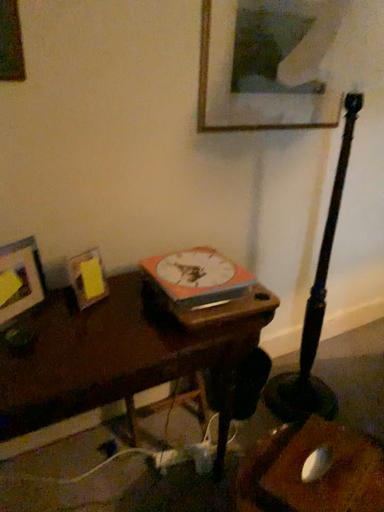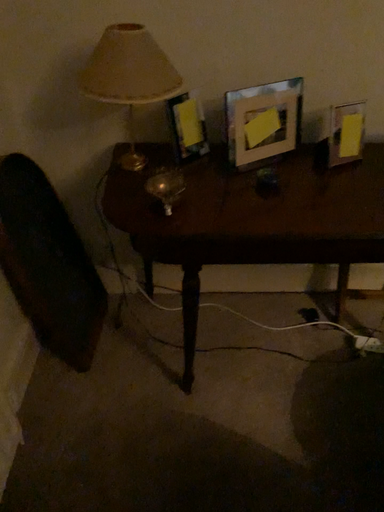
Question: How did the camera likely rotate when shooting the video?

Choices:
 (A) rotated left
 (B) rotated right

Answer: (A)